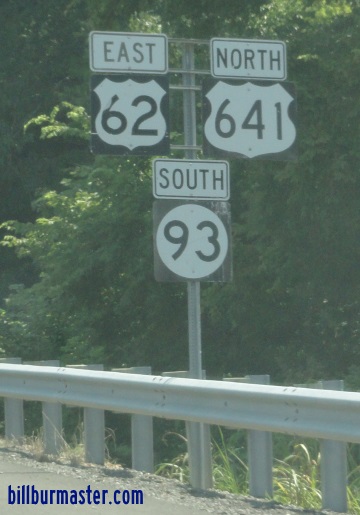
This screenshot has height=515, width=360. I want to click on side rail, so click(x=93, y=387).